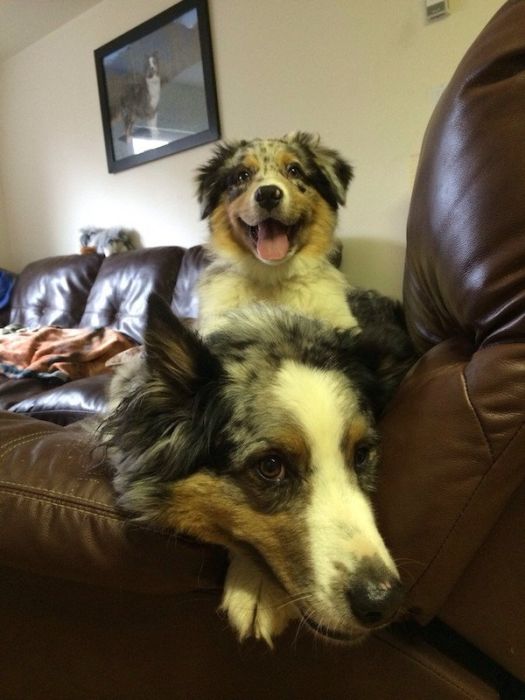
Locate an element on the screen. thermostat is located at coordinates (435, 8).